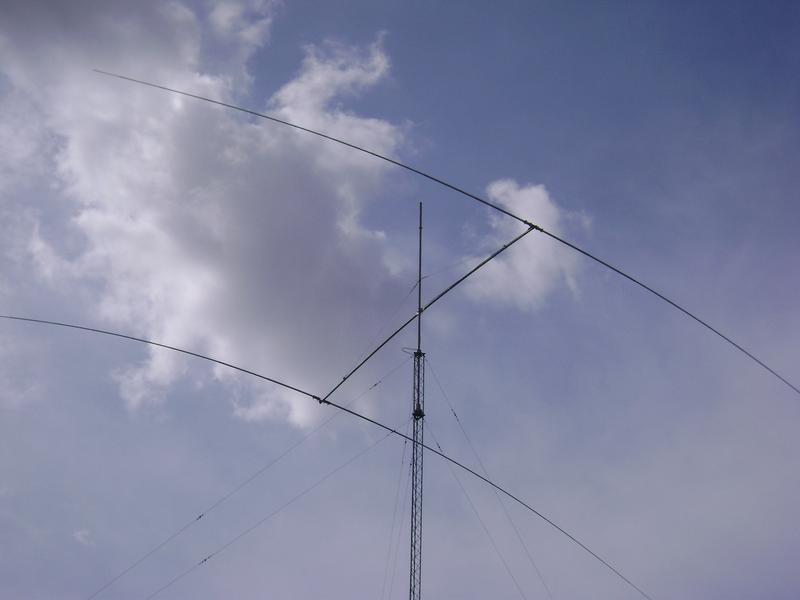
What are the coordinates of `wires` in the screenshot? It's located at (282, 506).